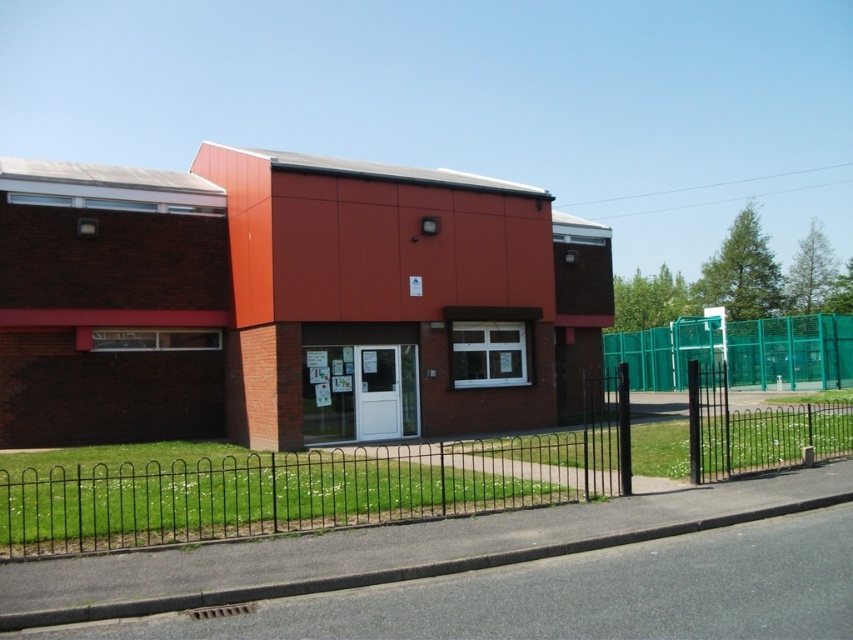
Question: Among these points, which one is nearest to the camera?

Choices:
 (A) (15, 545)
 (B) (643, 374)

Answer: (A)

Question: Does black wrought iron fence at center have a smaller size compared to green mesh fence at center?

Choices:
 (A) no
 (B) yes

Answer: (A)

Question: Can you confirm if black wrought iron fence at center is smaller than green mesh fence at center?

Choices:
 (A) yes
 (B) no

Answer: (B)

Question: Which object is closer to the camera taking this photo?

Choices:
 (A) green mesh fence at center
 (B) black wrought iron fence at center

Answer: (B)

Question: Observing the image, what is the correct spatial positioning of black wrought iron fence at center in reference to green mesh fence at center?

Choices:
 (A) left
 (B) right

Answer: (A)

Question: Which point is farther from the camera taking this photo?

Choices:
 (A) (386, 500)
 (B) (653, 388)

Answer: (B)